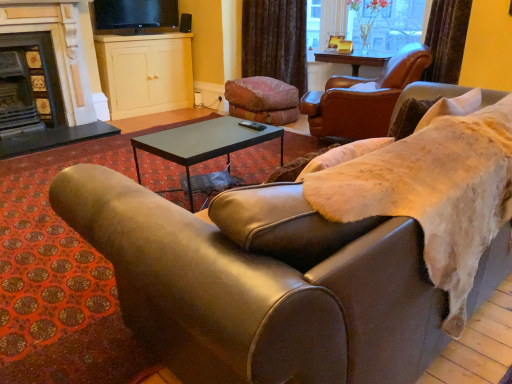
Question: Can you confirm if dark gray stone fireplace at left, marked as the second fireplace in a left-to-right arrangement, is taller than leather armchair at upper right?

Choices:
 (A) no
 (B) yes

Answer: (B)

Question: Is dark gray stone fireplace at left, positioned as the 1th fireplace in right-to-left order, oriented towards leather armchair at upper right?

Choices:
 (A) yes
 (B) no

Answer: (B)

Question: Is dark gray stone fireplace at left, positioned as the 1th fireplace in right-to-left order, wider than leather armchair at upper right?

Choices:
 (A) no
 (B) yes

Answer: (A)

Question: Is dark gray stone fireplace at left, positioned as the 1th fireplace in right-to-left order, not near leather armchair at upper right?

Choices:
 (A) yes
 (B) no

Answer: (A)

Question: Considering the relative positions of dark gray stone fireplace at left, positioned as the 1th fireplace in right-to-left order, and leather armchair at upper right in the image provided, is dark gray stone fireplace at left, positioned as the 1th fireplace in right-to-left order, behind leather armchair at upper right?

Choices:
 (A) yes
 (B) no

Answer: (A)

Question: Is dark gray stone fireplace at left, marked as the second fireplace in a left-to-right arrangement, located outside leather armchair at upper right?

Choices:
 (A) yes
 (B) no

Answer: (A)

Question: From the image's perspective, is black glossy tv at upper center under leather couch at center?

Choices:
 (A) no
 (B) yes

Answer: (A)

Question: From the image's perspective, would you say black glossy tv at upper center is positioned over leather couch at center?

Choices:
 (A) yes
 (B) no

Answer: (A)

Question: Can you confirm if black glossy tv at upper center is positioned to the right of leather couch at center?

Choices:
 (A) no
 (B) yes

Answer: (A)

Question: Is black glossy tv at upper center in front of leather couch at center?

Choices:
 (A) yes
 (B) no

Answer: (B)

Question: Does black glossy tv at upper center come behind leather couch at center?

Choices:
 (A) no
 (B) yes

Answer: (B)

Question: From a real-world perspective, is black glossy tv at upper center below leather couch at center?

Choices:
 (A) yes
 (B) no

Answer: (B)

Question: Does dark gray stone fireplace at left, positioned as the 1th fireplace in right-to-left order, appear on the right side of leather couch at center?

Choices:
 (A) no
 (B) yes

Answer: (A)